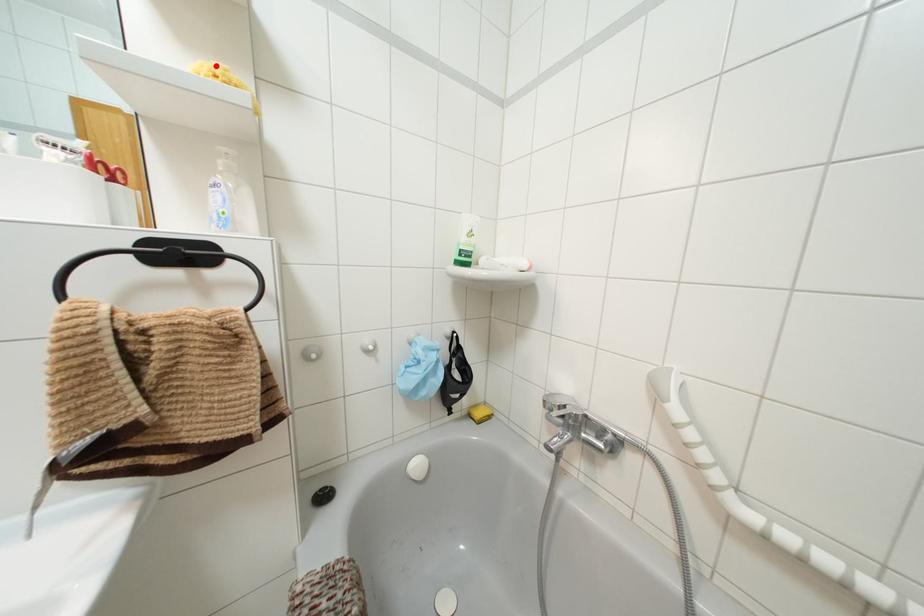
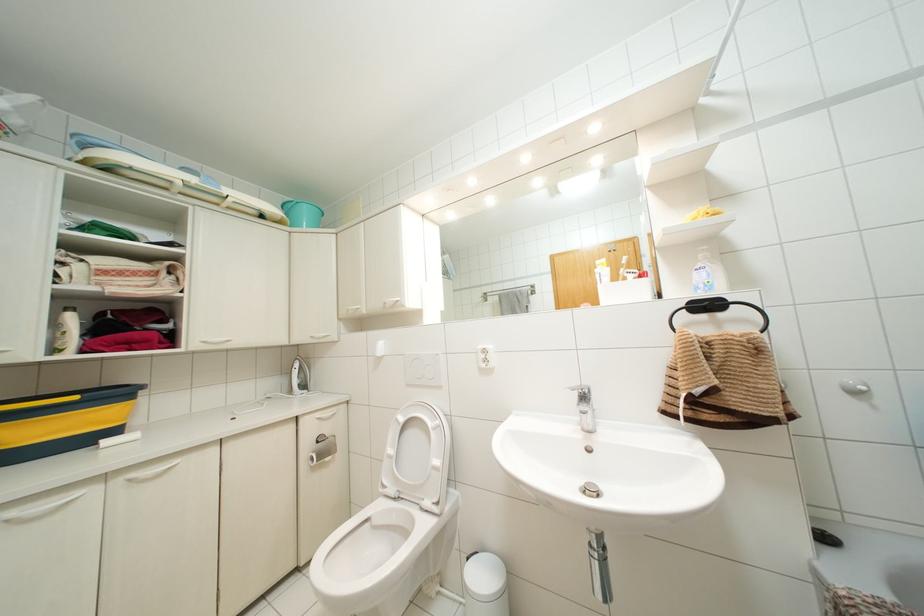
Where in the second image is the point corresponding to the highlighted location from the first image?

(701, 208)